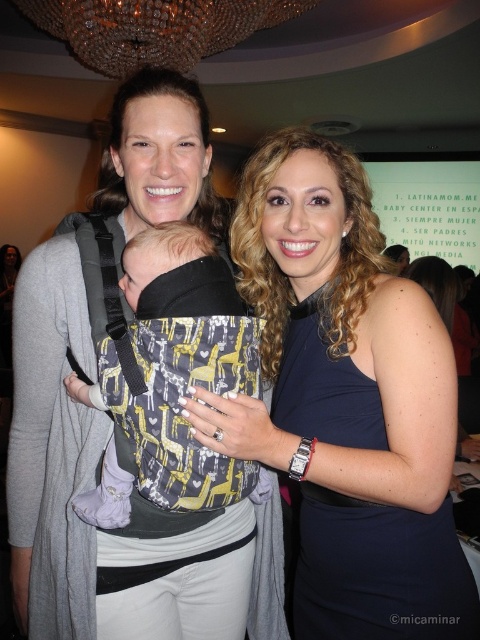
You are a photographer at a social event and need to capture a clear photo of the matte black dress at center and the matte black baby carrier at center. Which object should you focus on first to ensure it appears sharp in the photo?

The matte black dress at center is in front of the matte black baby carrier at center, so you should focus on the matte black dress at center first to ensure it appears sharp.

You are standing at the origin point in the image. Which of the two points, point (127, 164) or point (253, 464), is located behind the other?

Point (127, 164) is behind point (253, 464).